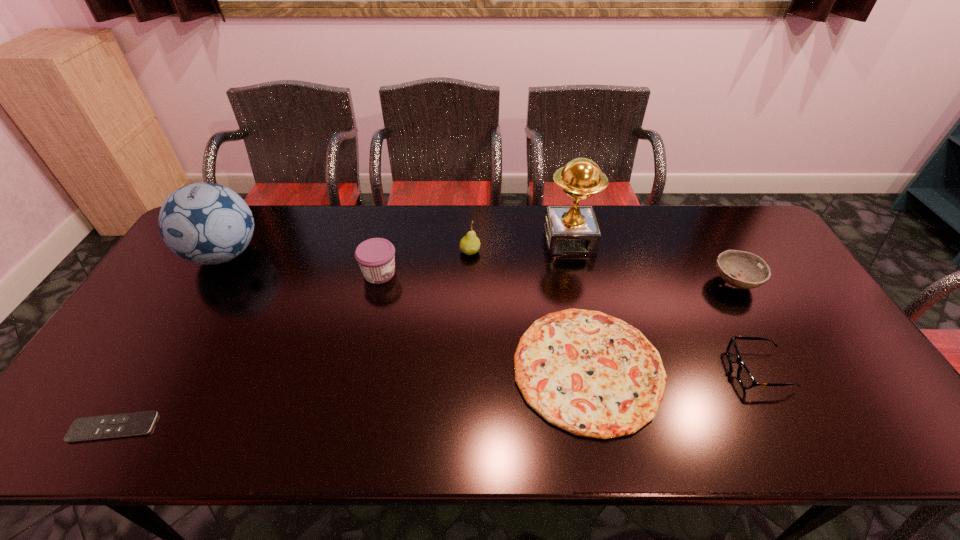
You are a GUI agent. You are given a task and a screenshot of the screen. Output one action in this format:
    pyautogui.click(x=<x>, y=<y>)
    Task: Click on the vacant space situated on the side with brand of the soccer ball
    
    Given the screenshot: What is the action you would take?
    pyautogui.click(x=148, y=381)

Find the location of `vacant space located 0.360m on the front of the pear`. vacant space located 0.360m on the front of the pear is located at coordinates (468, 353).

Find the location of a particular element. vacant space located 0.390m on the front label of the sixth object from right to left is located at coordinates (526, 273).

You are a GUI agent. You are given a task and a screenshot of the screen. Output one action in this format:
    pyautogui.click(x=<x>, y=<y>)
    Task: Click on the vacant point located on the back of the bowl
    
    Given the screenshot: What is the action you would take?
    pyautogui.click(x=702, y=224)

Locate an element on the screen. The height and width of the screenshot is (540, 960). free space located 0.080m on the front-facing side of the sunglasses is located at coordinates (699, 370).

At what (x,y) coordinates should I click in order to perform the action: click on free space located 0.140m on the front-facing side of the sunglasses. Please return your answer as a coordinate pair (x, y). The width and height of the screenshot is (960, 540). Looking at the image, I should click on (676, 370).

Where is `vacant area situated 0.070m on the front-facing side of the sunglasses`? The height and width of the screenshot is (540, 960). vacant area situated 0.070m on the front-facing side of the sunglasses is located at coordinates (704, 370).

The image size is (960, 540). Find the location of `free spot located 0.270m on the left of the second shortest object`. free spot located 0.270m on the left of the second shortest object is located at coordinates (407, 368).

Locate an element on the screen. vacant space located on the back of the shortest object is located at coordinates (193, 298).

Where is `award that is at the far edge`? The image size is (960, 540). award that is at the far edge is located at coordinates (570, 230).